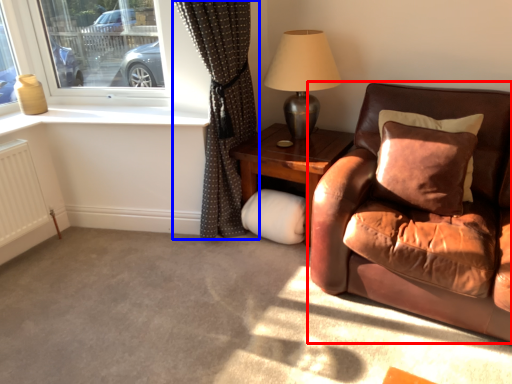
Question: Among these objects, which one is farthest to the camera, studio couch (highlighted by a red box) or curtain (highlighted by a blue box)?

Choices:
 (A) studio couch
 (B) curtain

Answer: (B)